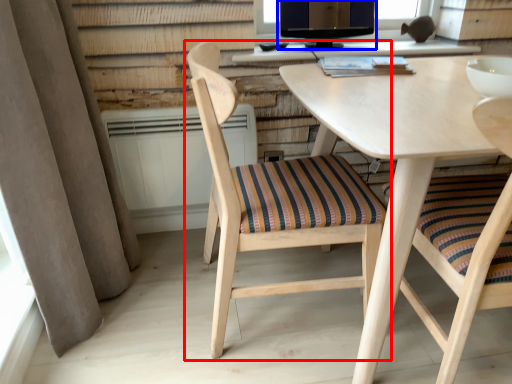
Question: Which of the following is the farthest to the observer, chair (highlighted by a red box) or computer monitor (highlighted by a blue box)?

Choices:
 (A) chair
 (B) computer monitor

Answer: (B)